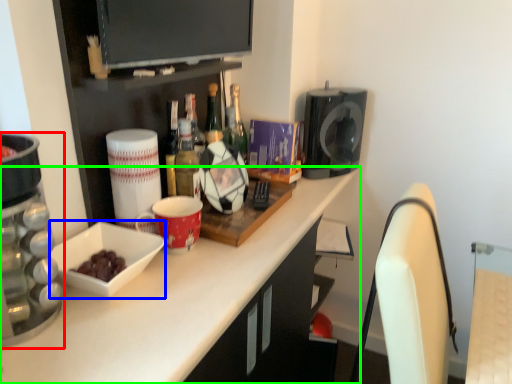
Question: Considering the real-world distances, which object is closest to home appliance (highlighted by a red box)? bowl (highlighted by a blue box) or countertop (highlighted by a green box).

Choices:
 (A) bowl
 (B) countertop

Answer: (A)